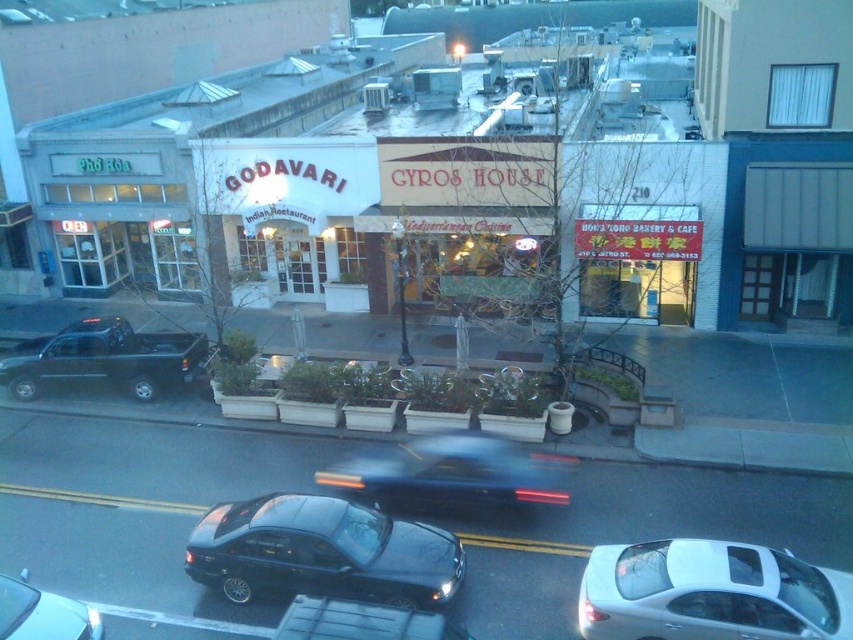
Can you confirm if black matte truck at left is thinner than shiny black sedan at lower left?

In fact, black matte truck at left might be wider than shiny black sedan at lower left.

In the scene shown: Is black matte truck at left below shiny black sedan at lower left?

No, black matte truck at left is not below shiny black sedan at lower left.

The image size is (853, 640). Describe the element at coordinates (106, 358) in the screenshot. I see `black matte truck at left` at that location.

Locate an element on the screen. The image size is (853, 640). black matte truck at left is located at coordinates (106, 358).

Consider the image. Between shiny black sedan at center and white glossy sedan at center, which one has less height?

With less height is white glossy sedan at center.

Is point (292, 515) closer to camera compared to point (670, 609)?

No, (292, 515) is behind (670, 609).

The height and width of the screenshot is (640, 853). In order to click on shiny black sedan at center in this screenshot , I will do `click(322, 552)`.

Looking at this image, does white glossy sedan at center have a lesser height compared to black matte car at center?

Incorrect, white glossy sedan at center's height does not fall short of black matte car at center's.

Is point (666, 557) closer to viewer compared to point (293, 611)?

No, it is behind (293, 611).

Which is in front, point (657, 609) or point (454, 636)?

Positioned in front is point (454, 636).

At what (x,y) coordinates should I click in order to perform the action: click on white glossy sedan at center. Please return your answer as a coordinate pair (x, y). The height and width of the screenshot is (640, 853). Looking at the image, I should click on (709, 593).